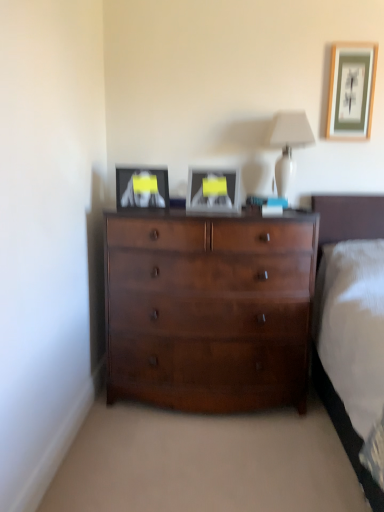
The image size is (384, 512). What do you see at coordinates (209, 311) in the screenshot?
I see `shiny brown dresser at center` at bounding box center [209, 311].

Locate an element on the screen. matte black picture frame at upper left, marked as the third picture frame in a top-to-bottom arrangement is located at coordinates (142, 188).

Identify the location of white glossy table lamp at upper center. The height and width of the screenshot is (512, 384). (288, 146).

The height and width of the screenshot is (512, 384). What are the coordinates of `shiny brown dresser at center` in the screenshot? It's located at (209, 311).

Looking at this image, from a real-world perspective, is matte black picture frame at upper left, the third picture frame when ordered from right to left, physically located above or below shiny brown dresser at center?

matte black picture frame at upper left, the third picture frame when ordered from right to left, is situated higher than shiny brown dresser at center in the real world.

Considering the sizes of matte black picture frame at upper left, arranged as the first picture frame when viewed from the left, and shiny brown dresser at center in the image, is matte black picture frame at upper left, arranged as the first picture frame when viewed from the left, taller or shorter than shiny brown dresser at center?

Considering their sizes, matte black picture frame at upper left, arranged as the first picture frame when viewed from the left, has less height than shiny brown dresser at center.

Who is bigger, matte black picture frame at upper left, the third picture frame when ordered from right to left, or shiny brown dresser at center?

shiny brown dresser at center.

In the scene shown: Is matte black picture frame at upper left, arranged as the first picture frame when viewed from the left, inside the boundaries of shiny brown dresser at center, or outside?

matte black picture frame at upper left, arranged as the first picture frame when viewed from the left, lies outside shiny brown dresser at center.

Is matte silver picture frame at center, marked as the second picture frame in a left-to-right arrangement, to the right of white glossy table lamp at upper center from the viewer's perspective?

No.

Considering the relative sizes of matte silver picture frame at center, positioned as the 2th picture frame in bottom-to-top order, and white glossy table lamp at upper center in the image provided, is matte silver picture frame at center, positioned as the 2th picture frame in bottom-to-top order, bigger than white glossy table lamp at upper center?

Incorrect, matte silver picture frame at center, positioned as the 2th picture frame in bottom-to-top order, is not larger than white glossy table lamp at upper center.

Considering the sizes of matte silver picture frame at center, marked as the second picture frame in a left-to-right arrangement, and white glossy table lamp at upper center in the image, is matte silver picture frame at center, marked as the second picture frame in a left-to-right arrangement, wider or thinner than white glossy table lamp at upper center?

Considering their sizes, matte silver picture frame at center, marked as the second picture frame in a left-to-right arrangement, looks slimmer than white glossy table lamp at upper center.

From the image's perspective, is matte silver picture frame at center, acting as the second picture frame starting from the right, positioned above or below white glossy table lamp at upper center?

matte silver picture frame at center, acting as the second picture frame starting from the right, is situated lower than white glossy table lamp at upper center in the image.

Is shiny brown dresser at center a part of matte silver picture frame at center, which is the second picture frame from top to bottom?

That's incorrect, shiny brown dresser at center is not inside matte silver picture frame at center, which is the second picture frame from top to bottom.

In the image, is matte silver picture frame at center, marked as the second picture frame in a left-to-right arrangement, on the left side or the right side of shiny brown dresser at center?

Clearly, matte silver picture frame at center, marked as the second picture frame in a left-to-right arrangement, is on the right of shiny brown dresser at center in the image.

Considering the positions of point (226, 181) and point (206, 330), is point (226, 181) closer or farther from the camera than point (206, 330)?

Point (226, 181) is positioned farther from the camera compared to point (206, 330).

In the image, is matte silver picture frame at center, acting as the second picture frame starting from the right, positioned in front of or behind shiny brown dresser at center?

Visually, matte silver picture frame at center, acting as the second picture frame starting from the right, is located behind shiny brown dresser at center.

Is white glossy table lamp at upper center next to shiny brown dresser at center and touching it?

No, white glossy table lamp at upper center is not with shiny brown dresser at center.

Is white glossy table lamp at upper center oriented towards shiny brown dresser at center?

No.

Considering the positions of point (288, 191) and point (191, 331), is point (288, 191) closer or farther from the camera than point (191, 331)?

Point (288, 191) is farther from the camera than point (191, 331).

Which of these two, white glossy table lamp at upper center or matte silver picture frame at center, positioned as the 2th picture frame in bottom-to-top order, stands shorter?

matte silver picture frame at center, positioned as the 2th picture frame in bottom-to-top order, is shorter.

From the image's perspective, is white glossy table lamp at upper center above or below matte silver picture frame at center, positioned as the 2th picture frame in bottom-to-top order?

From the image's perspective, white glossy table lamp at upper center appears above matte silver picture frame at center, positioned as the 2th picture frame in bottom-to-top order.

From a real-world perspective, is white glossy table lamp at upper center physically below matte silver picture frame at center, acting as the second picture frame starting from the right?

No, from a real-world perspective, white glossy table lamp at upper center is not under matte silver picture frame at center, acting as the second picture frame starting from the right.

Considering the sizes of white glossy table lamp at upper center and matte silver picture frame at center, positioned as the 2th picture frame in bottom-to-top order, in the image, is white glossy table lamp at upper center wider or thinner than matte silver picture frame at center, positioned as the 2th picture frame in bottom-to-top order,?

In the image, white glossy table lamp at upper center appears to be wider than matte silver picture frame at center, positioned as the 2th picture frame in bottom-to-top order.

Considering the relative sizes of matte silver picture frame at center, positioned as the 2th picture frame in bottom-to-top order, and matte black picture frame at upper left, arranged as the first picture frame when viewed from the left, in the image provided, is matte silver picture frame at center, positioned as the 2th picture frame in bottom-to-top order, wider than matte black picture frame at upper left, arranged as the first picture frame when viewed from the left,?

In fact, matte silver picture frame at center, positioned as the 2th picture frame in bottom-to-top order, might be narrower than matte black picture frame at upper left, arranged as the first picture frame when viewed from the left.

From a real-world perspective, does matte silver picture frame at center, marked as the second picture frame in a left-to-right arrangement, stand above matte black picture frame at upper left, marked as the third picture frame in a top-to-bottom arrangement?

Yes.

In the scene shown: From the image's perspective, is matte silver picture frame at center, which is the second picture frame from top to bottom, below matte black picture frame at upper left, which is the first picture frame from bottom to top?

No, from the image's perspective, matte silver picture frame at center, which is the second picture frame from top to bottom, is not below matte black picture frame at upper left, which is the first picture frame from bottom to top.

Is matte silver picture frame at center, positioned as the 2th picture frame in bottom-to-top order, taller or shorter than matte black picture frame at upper left, which is the first picture frame from bottom to top?

In the image, matte silver picture frame at center, positioned as the 2th picture frame in bottom-to-top order, appears to be taller than matte black picture frame at upper left, which is the first picture frame from bottom to top.

From a real-world perspective, which is physically below, matte black picture frame at upper left, marked as the third picture frame in a top-to-bottom arrangement, or white glossy table lamp at upper center?

matte black picture frame at upper left, marked as the third picture frame in a top-to-bottom arrangement, from a real-world perspective.

Is matte black picture frame at upper left, which is the first picture frame from bottom to top, smaller than white glossy table lamp at upper center?

Yes, matte black picture frame at upper left, which is the first picture frame from bottom to top, is smaller than white glossy table lamp at upper center.

Who is taller, matte black picture frame at upper left, the third picture frame when ordered from right to left, or white glossy table lamp at upper center?

Standing taller between the two is white glossy table lamp at upper center.

Locate an element on the screen. This screenshot has height=512, width=384. chest of drawers on the right of matte black picture frame at upper left, arranged as the first picture frame when viewed from the left is located at coordinates (209, 311).

You are a GUI agent. You are given a task and a screenshot of the screen. Output one action in this format:
    pyautogui.click(x=<x>, y=<y>)
    Task: Click on the 1st picture frame below when counting from the white glossy table lamp at upper center (from the image's perspective)
    This screenshot has height=512, width=384.
    Given the screenshot: What is the action you would take?
    pyautogui.click(x=212, y=190)

Looking at the image, which one is located closer to wooden framed artwork at upper right, the third picture frame in the left-to-right sequence, white glossy table lamp at upper center or matte silver picture frame at center, which is the second picture frame from top to bottom?

Based on the image, white glossy table lamp at upper center appears to be nearer to wooden framed artwork at upper right, the third picture frame in the left-to-right sequence.

Considering their positions, is wooden framed artwork at upper right, the 3th picture frame when ordered from bottom to top, positioned further to matte black picture frame at upper left, the third picture frame when ordered from right to left, than shiny brown dresser at center?

wooden framed artwork at upper right, the 3th picture frame when ordered from bottom to top, is positioned further to the anchor matte black picture frame at upper left, the third picture frame when ordered from right to left.

From the image, which object appears to be nearer to wooden framed artwork at upper right, the 3th picture frame when ordered from bottom to top, white glossy table lamp at upper center or shiny brown dresser at center?

Among the two, white glossy table lamp at upper center is located nearer to wooden framed artwork at upper right, the 3th picture frame when ordered from bottom to top.

When comparing their distances from matte black picture frame at upper left, arranged as the first picture frame when viewed from the left, does white glossy table lamp at upper center or shiny brown dresser at center seem closer?

Based on the image, shiny brown dresser at center appears to be nearer to matte black picture frame at upper left, arranged as the first picture frame when viewed from the left.

From the image, which object appears to be farther from matte silver picture frame at center, positioned as the 2th picture frame in bottom-to-top order, matte black picture frame at upper left, the third picture frame when ordered from right to left, or wooden framed artwork at upper right, the third picture frame in the left-to-right sequence?

Based on the image, wooden framed artwork at upper right, the third picture frame in the left-to-right sequence, appears to be further to matte silver picture frame at center, positioned as the 2th picture frame in bottom-to-top order.

Considering their positions, is matte silver picture frame at center, acting as the second picture frame starting from the right, positioned closer to shiny brown dresser at center than white glossy table lamp at upper center?

Based on the image, matte silver picture frame at center, acting as the second picture frame starting from the right, appears to be nearer to shiny brown dresser at center.

From the image, which object appears to be farther from shiny brown dresser at center, matte silver picture frame at center, which is the second picture frame from top to bottom, or matte black picture frame at upper left, which is the first picture frame from bottom to top?

matte black picture frame at upper left, which is the first picture frame from bottom to top, is positioned further to the anchor shiny brown dresser at center.

Which object lies nearer to the anchor point white glossy table lamp at upper center, shiny brown dresser at center or wooden framed artwork at upper right, the first picture frame viewed from the right?

The object closer to white glossy table lamp at upper center is wooden framed artwork at upper right, the first picture frame viewed from the right.

This screenshot has height=512, width=384. Identify the location of table lamp between wooden framed artwork at upper right, the first picture frame viewed from the right, and shiny brown dresser at center from top to bottom. (288, 146).

What are the coordinates of `table lamp situated between matte silver picture frame at center, marked as the second picture frame in a left-to-right arrangement, and wooden framed artwork at upper right, the 3th picture frame when ordered from bottom to top, from left to right` in the screenshot? It's located at (288, 146).

At what (x,y) coordinates should I click in order to perform the action: click on picture frame between matte black picture frame at upper left, arranged as the first picture frame when viewed from the left, and white glossy table lamp at upper center from left to right. Please return your answer as a coordinate pair (x, y). This screenshot has width=384, height=512. Looking at the image, I should click on [x=212, y=190].

This screenshot has height=512, width=384. I want to click on table lamp between matte black picture frame at upper left, which is the first picture frame from bottom to top, and wooden framed artwork at upper right, the 3th picture frame when ordered from bottom to top, from left to right, so click(x=288, y=146).